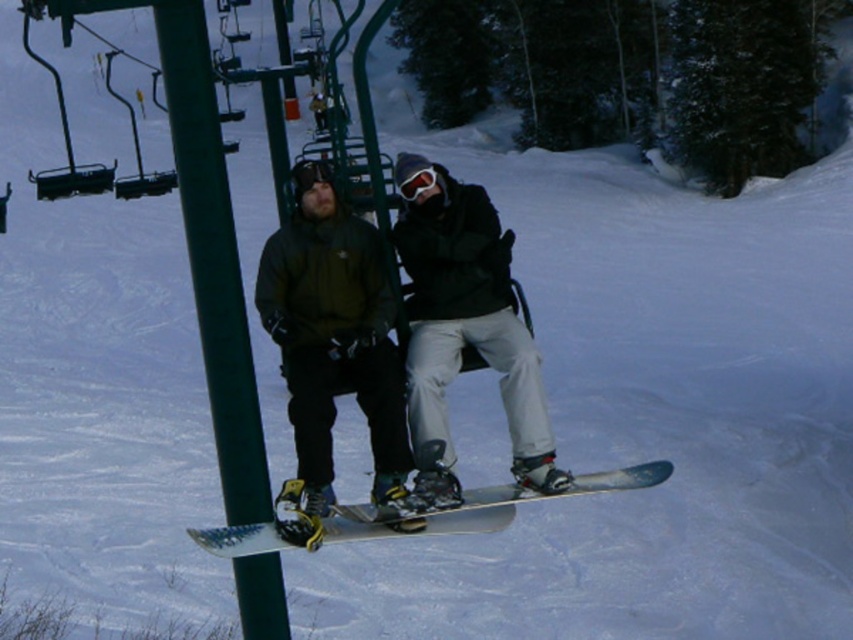
Measure the distance from matte black snowboard at center to white matte snowboard at center.

They are 1.55 meters apart.

Does matte black snowboard at center have a greater width compared to white matte snowboard at center?

Yes, matte black snowboard at center is wider than white matte snowboard at center.

Does point (459, 497) come behind point (434, 522)?

No, it is not.

Image resolution: width=853 pixels, height=640 pixels. What are the coordinates of `matte black snowboard at center` in the screenshot? It's located at (463, 330).

Can you confirm if matte black snowboard at center is taller than green metallic pole at left?

Incorrect, matte black snowboard at center's height is not larger of green metallic pole at left's.

Does point (421, 307) come behind point (196, 10)?

Yes, point (421, 307) is farther from viewer.

Where is `matte black snowboard at center`? The height and width of the screenshot is (640, 853). matte black snowboard at center is located at coordinates (463, 330).

The width and height of the screenshot is (853, 640). What are the coordinates of `green metallic pole at left` in the screenshot? It's located at (213, 259).

Between point (183, 136) and point (244, 552), which one is positioned behind?

Positioned behind is point (244, 552).

Identify the location of green metallic pole at left. This screenshot has height=640, width=853. (213, 259).